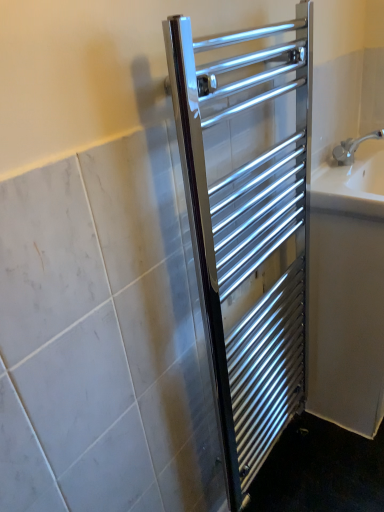
The height and width of the screenshot is (512, 384). What do you see at coordinates (347, 292) in the screenshot? I see `white glossy bath at right` at bounding box center [347, 292].

Locate an element on the screen. The height and width of the screenshot is (512, 384). white glossy bath at right is located at coordinates (347, 292).

Can we say white ceramic sink at right lies outside white glossy bath at right?

Indeed, white ceramic sink at right is completely outside white glossy bath at right.

Is white ceramic sink at right turned away from white glossy bath at right?

white ceramic sink at right does not have its back to white glossy bath at right.

Does white ceramic sink at right have a larger size compared to white glossy bath at right?

Actually, white ceramic sink at right might be smaller than white glossy bath at right.

Can you confirm if white ceramic sink at right is thinner than white glossy bath at right?

Correct, the width of white ceramic sink at right is less than that of white glossy bath at right.

What are the coordinates of `bath on the right of polished chrome towel rack at center` in the screenshot? It's located at (347, 292).

Looking at the image, does polished chrome towel rack at center seem bigger or smaller compared to white glossy bath at right?

Considering their sizes, polished chrome towel rack at center takes up less space than white glossy bath at right.

Which is nearer, (292, 169) or (318, 328)?

Point (292, 169) is closer to the camera than point (318, 328).

Between polished chrome towel rack at center and white glossy bath at right, which one is positioned in front?

polished chrome towel rack at center.

Is the depth of white glossy bath at right greater than that of polished chrome towel rack at center?

Yes, it is behind polished chrome towel rack at center.

From the image's perspective, would you say white glossy bath at right is positioned over polished chrome towel rack at center?

Incorrect, from the image's perspective, white glossy bath at right is lower than polished chrome towel rack at center.

The image size is (384, 512). I want to click on screen door that appears in front of the white glossy bath at right, so click(247, 243).

Considering the relative positions of polished chrome towel rack at center and white ceramic sink at right in the image provided, is polished chrome towel rack at center to the left of white ceramic sink at right from the viewer's perspective?

Yes, polished chrome towel rack at center is to the left of white ceramic sink at right.

Is polished chrome towel rack at center thinner than white ceramic sink at right?

Yes.

Is point (303, 307) closer or farther from the camera than point (345, 193)?

Clearly, point (303, 307) is more distant from the camera than point (345, 193).

How different are the orientations of polished chrome towel rack at center and white ceramic sink at right in degrees?

The angle between the facing direction of polished chrome towel rack at center and the facing direction of white ceramic sink at right is 0.786 degrees.

Is white glossy bath at right looking in the opposite direction of white ceramic sink at right?

No, white ceramic sink at right is not at the back of white glossy bath at right.

From the image's perspective, is white glossy bath at right on top of white ceramic sink at right?

Incorrect, from the image's perspective, white glossy bath at right is lower than white ceramic sink at right.

How many degrees apart are the facing directions of white glossy bath at right and white ceramic sink at right?

white glossy bath at right and white ceramic sink at right are facing 0.000982 degrees away from each other.

Based on their positions, is white glossy bath at right located to the left or right of white ceramic sink at right?

Clearly, white glossy bath at right is on the right of white ceramic sink at right in the image.

Who is smaller, white ceramic sink at right or polished chrome towel rack at center?

Smaller between the two is white ceramic sink at right.

How far apart are white ceramic sink at right and polished chrome towel rack at center?

white ceramic sink at right and polished chrome towel rack at center are 13.30 inches apart.

Does white ceramic sink at right appear on the right side of polished chrome towel rack at center?

Correct, you'll find white ceramic sink at right to the right of polished chrome towel rack at center.

Are white ceramic sink at right and polished chrome towel rack at center beside each other?

No, white ceramic sink at right is not beside polished chrome towel rack at center.

In order to click on bath behind the white ceramic sink at right in this screenshot , I will do `click(347, 292)`.

Image resolution: width=384 pixels, height=512 pixels. Identify the location of bath below the polished chrome towel rack at center (from a real-world perspective). (347, 292).

Looking at the image, which one is located closer to polished chrome towel rack at center, white ceramic sink at right or white glossy bath at right?

white glossy bath at right lies closer to polished chrome towel rack at center than the other object.

Based on their spatial positions, is white glossy bath at right or polished chrome towel rack at center further from white ceramic sink at right?

Among the two, polished chrome towel rack at center is located further to white ceramic sink at right.

Considering their positions, is white ceramic sink at right positioned closer to white glossy bath at right than polished chrome towel rack at center?

The object closer to white glossy bath at right is white ceramic sink at right.

Considering their positions, is polished chrome towel rack at center positioned further to white ceramic sink at right than white glossy bath at right?

polished chrome towel rack at center is positioned further to the anchor white ceramic sink at right.

Based on their spatial positions, is white glossy bath at right or white ceramic sink at right closer to polished chrome towel rack at center?

The object closer to polished chrome towel rack at center is white glossy bath at right.

Estimate the real-world distances between objects in this image. Which object is closer to white glossy bath at right, polished chrome towel rack at center or white ceramic sink at right?

The object closer to white glossy bath at right is white ceramic sink at right.

In order to click on sink positioned between polished chrome towel rack at center and white glossy bath at right from near to far in this screenshot , I will do `click(352, 178)`.